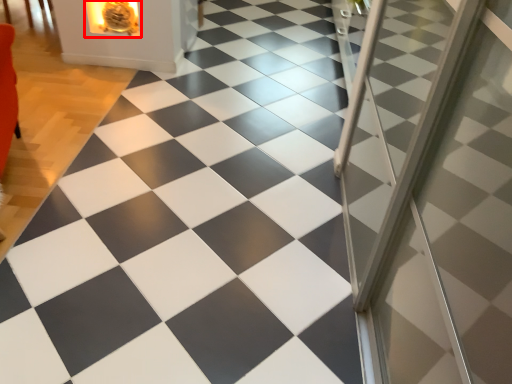
Question: Considering the relative positions of fireplace (annotated by the red box) and screen door in the image provided, where is fireplace (annotated by the red box) located with respect to the staircase?

Choices:
 (A) right
 (B) left

Answer: (B)